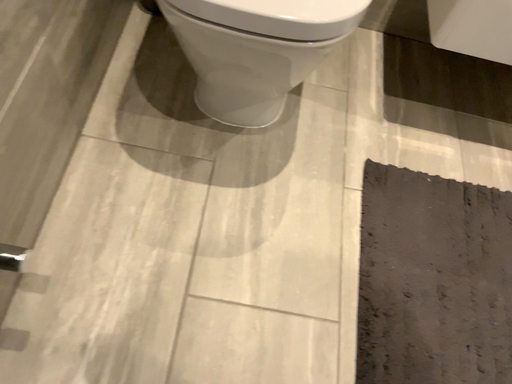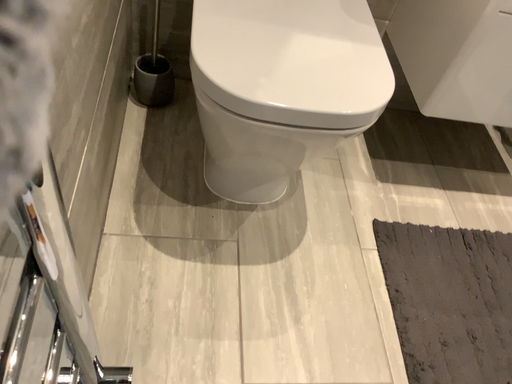
Question: How did the camera likely rotate when shooting the video?

Choices:
 (A) rotated downward
 (B) rotated upward

Answer: (B)